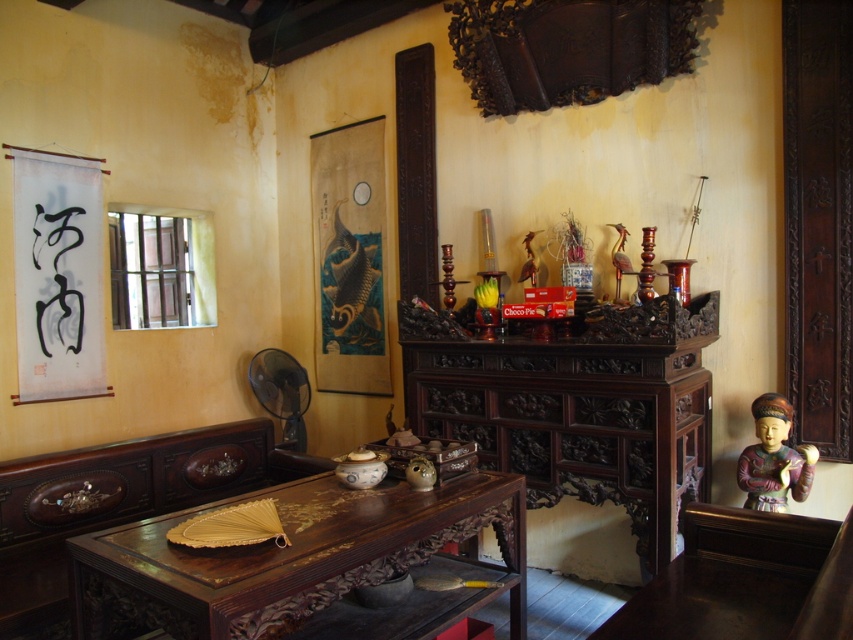
Who is more distant from viewer, (521, 556) or (762, 410)?

The point (762, 410) is behind.

Identify the location of wooden polished table at center. The image size is (853, 640). (286, 557).